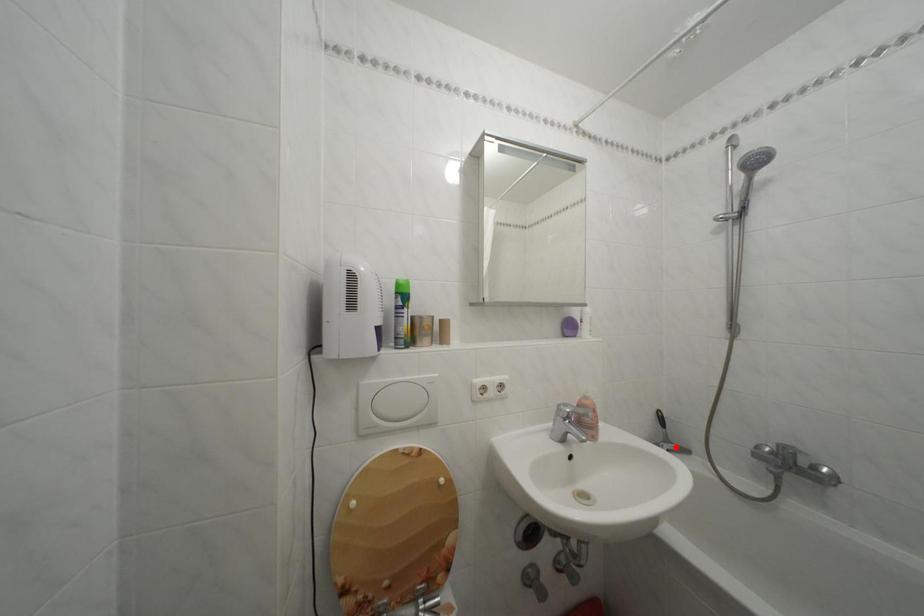
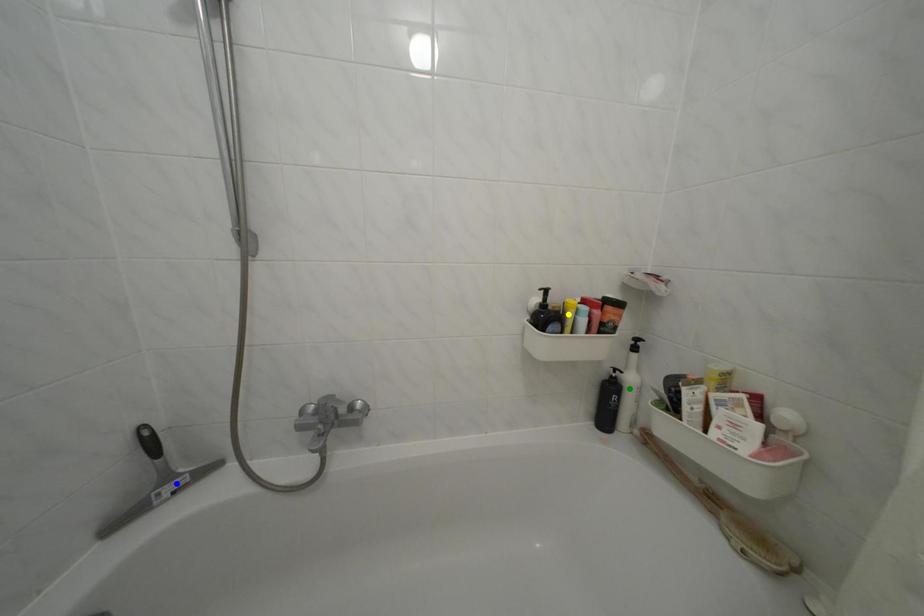
Question: I am providing you with two images of the same scene from different viewpoints. A red point is marked on the first image. You are given multiple points on the second image. Which mark in image 2 goes with the point in image 1?

Choices:
 (A) blue point
 (B) green point
 (C) yellow point

Answer: (A)